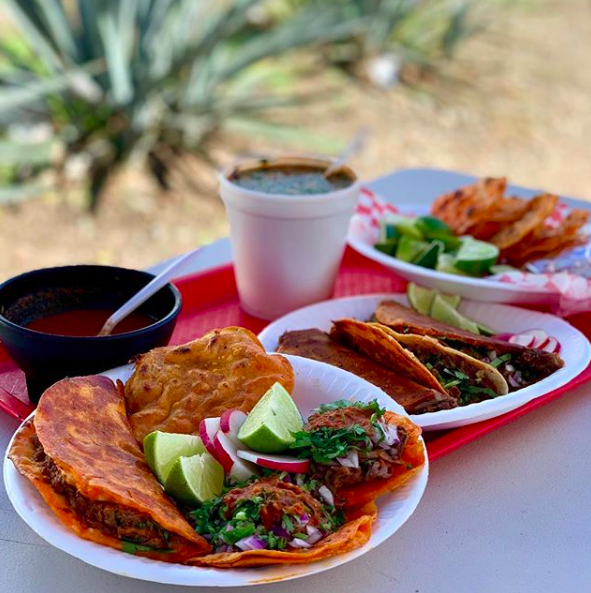
Image resolution: width=591 pixels, height=593 pixels. In order to click on plates in this screenshot , I will do (408, 496), (564, 347), (501, 286).